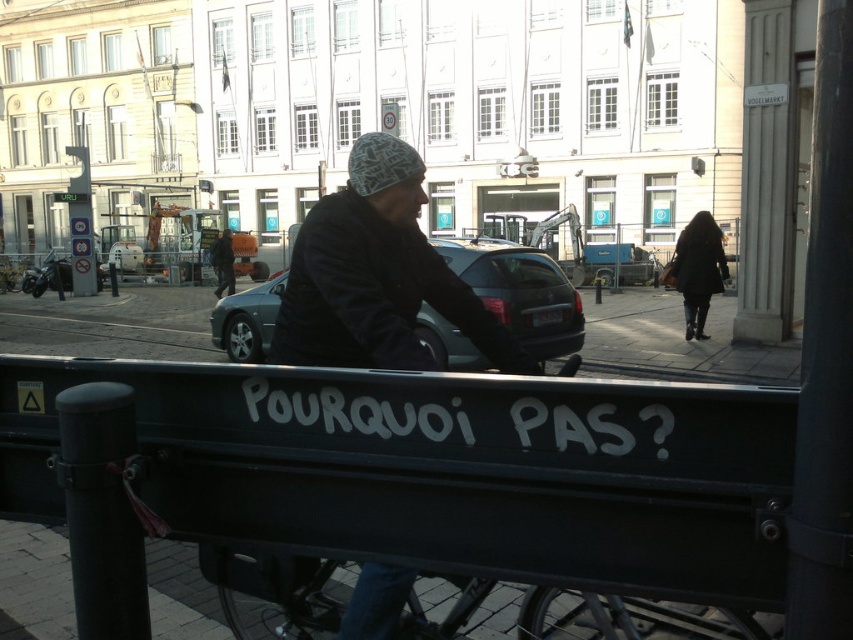
You are standing at the point marked by the coordinates point (376, 275) on black woolen hat at center. You want to walk to the parked car in the midground. Which direction should you go?

The point (376, 275) is on the black woolen hat at center. To reach the parked car in the midground, you should walk towards the midground direction from the center of the image.

You are a fashion designer observing the scene. You notice the black woolen hat at center and the dark brown coat at right. Which item of clothing takes up more visual space in the image?

The dark brown coat at right takes up more visual space than the black woolen hat at center because the black woolen hat at center occupies less space than dark brown coat at right.

You are a delivery person who needs to load a package onto the black painted metal cart at lower center. The package is the same size as the black woolen hat at center. Will the package fit on the cart?

The black painted metal cart at lower center has a larger size compared to the black woolen hat at center, so the package should fit on the cart since it is smaller than the cart.